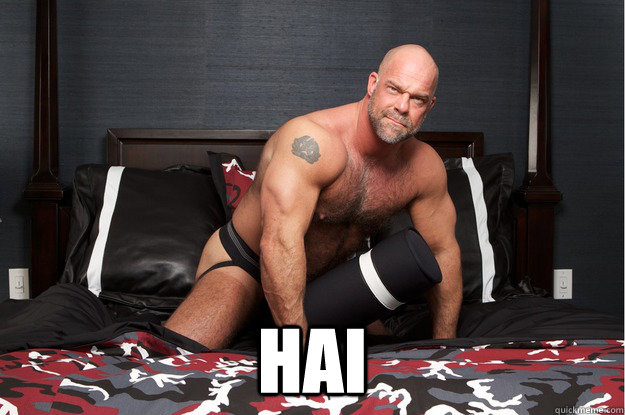
Locate an element on the screen. bed post is located at coordinates (538, 151).